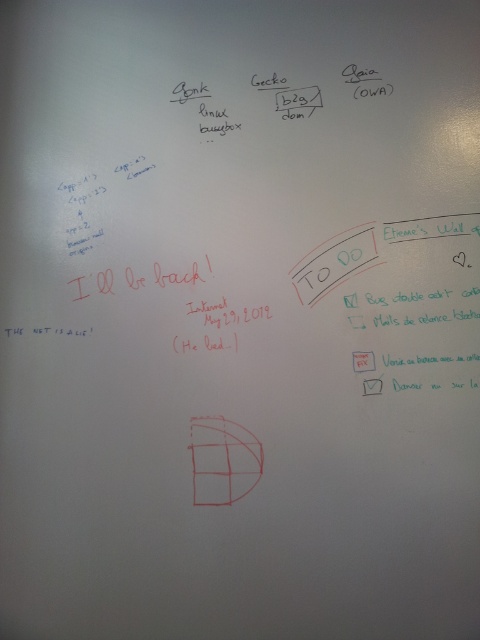
You are an assistant organizing the whiteboard. You need to place a white paper at center so it can be seen clearly. However, there is already a green marker text at center. What should you do?

The green marker text at center is located above the white paper at center, so you should move the green marker text at center downward to make space for the white paper at center to be visible.

What is the exact location of the green marker text at center on the whiteboard?

The green marker text at center is located at point (334,262).

You are standing in front of the whiteboard and notice two points marked on it. The first point is at coordinates point [343,266] and the second is at point [363,365]. Which point is closer to your eyes?

Point [363,365] is closer to your eyes because it is less further to the camera than point [343,266].